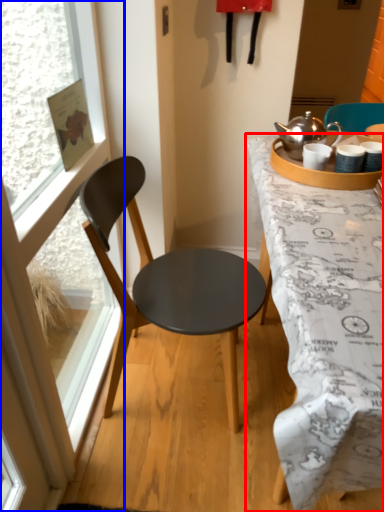
Question: Which of the following is the closest to the observer, desk (highlighted by a red box) or window (highlighted by a blue box)?

Choices:
 (A) desk
 (B) window

Answer: (B)